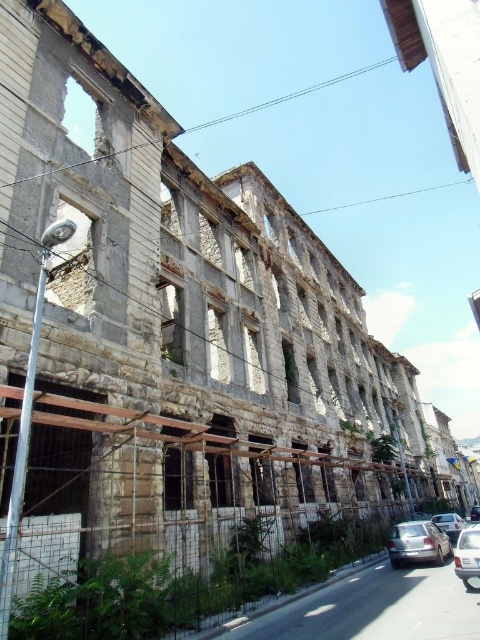
You are a delivery person needing to park your 15 feet long truck between the metallic silver car at lower right and the shiny black car at center. Is there enough space?

The metallic silver car at lower right and shiny black car at center are 55.55 feet apart. Since the truck is 15 feet long, there is sufficient space between them to park the truck.

You are a delivery driver who needs to park your truck, which is 2 meters wide, in the area near the silver metallic sedan at lower right and silver metallic car at lower right. Can your truck fit between these two vehicles if they are parked side by side?

The silver metallic sedan at lower right is wider than the silver metallic car at lower right. However, without knowing the exact spacing between them or the total available space, it is impossible to determine if the truck can fit. Additional information about the distance between the two vehicles is needed to make an accurate assessment.

You are a delivery person trying to park your vehicle in the street near the dilapidated building. You see a silver metallic sedan at lower right and a metallic silver car at lower right. Which vehicle takes up more space on the street?

The silver metallic sedan at lower right takes up more space on the street because its width surpasses that of the metallic silver car at lower right.